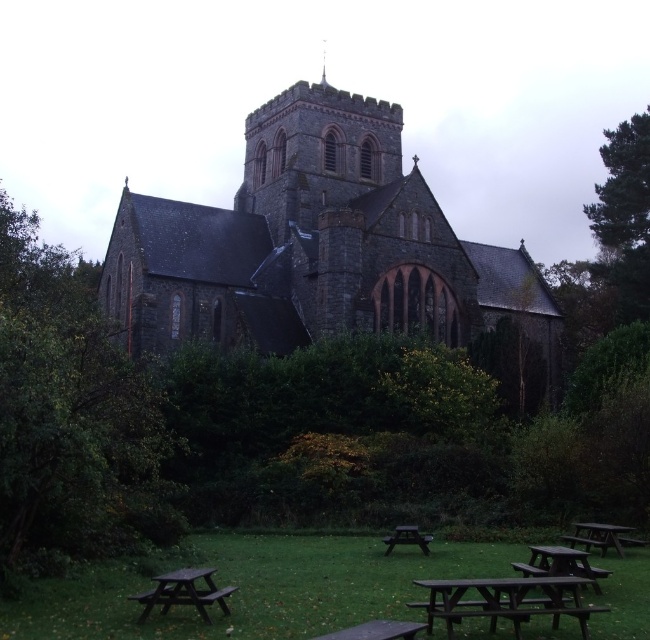
You are planning to host a small picnic at the church and need to set up a table. Given the presence of the green textured tree at right and the wooden picnic table at lower center, which object would you need to move if you want to place a larger picnic table in the same area?

The green textured tree at right would need to be moved because it is bigger than the wooden picnic table at lower center, making it the larger obstacle in the area.